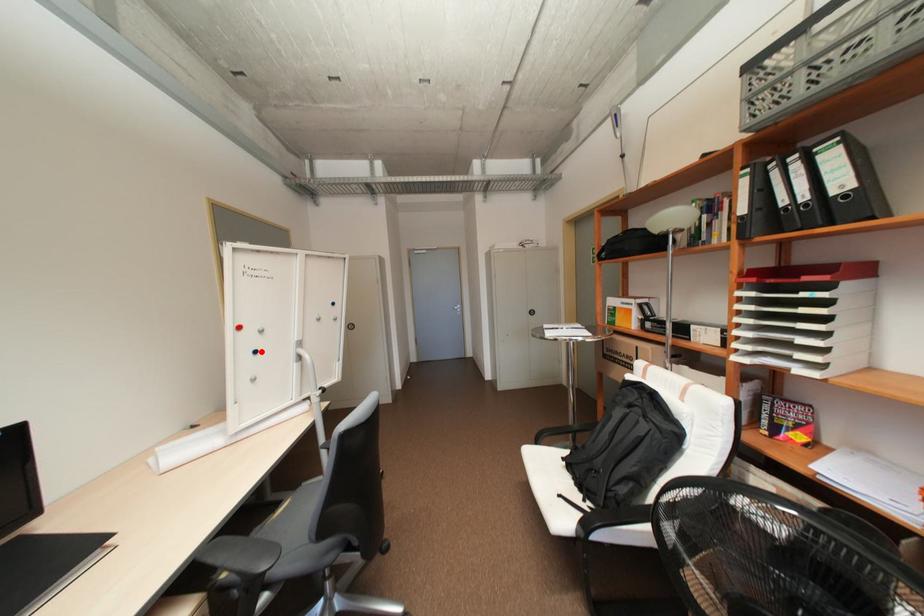
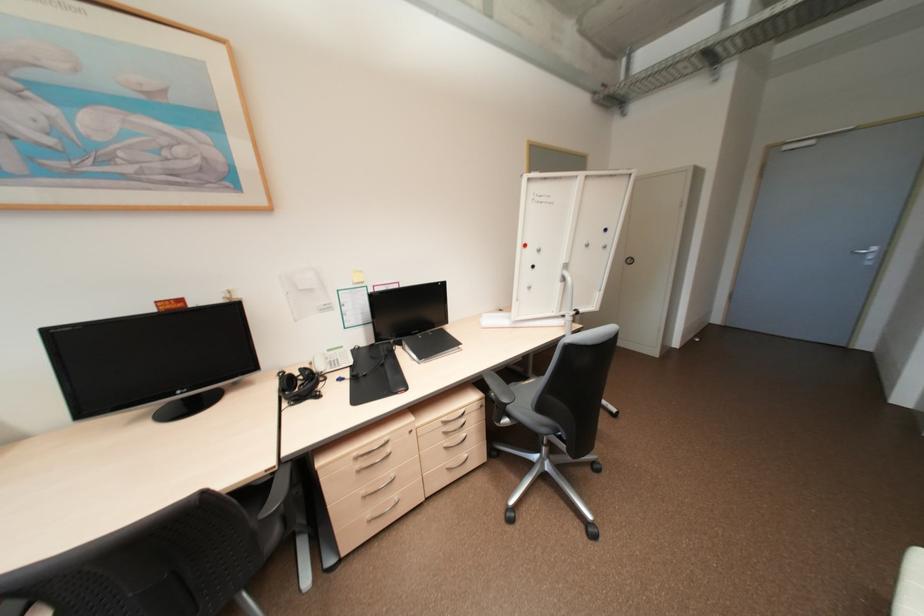
Locate, in the second image, the point that corresponds to the highlighted location in the first image.

(539, 265)